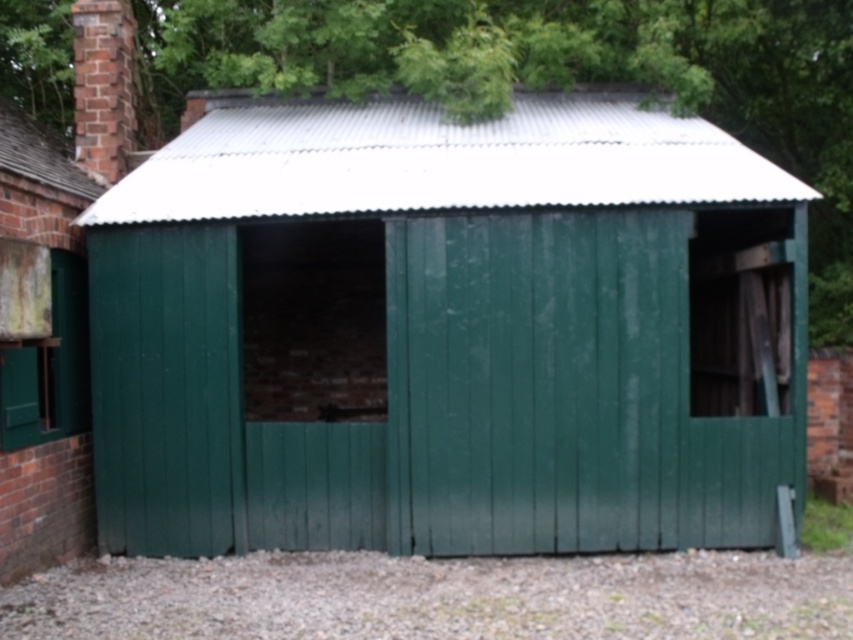
Does green woodshed at center lie in front of brick chimney at upper left?

Yes.

Measure the distance from green woodshed at center to brick chimney at upper left.

green woodshed at center and brick chimney at upper left are 7.34 feet apart.

This screenshot has height=640, width=853. In order to click on green woodshed at center in this screenshot , I will do `click(447, 332)`.